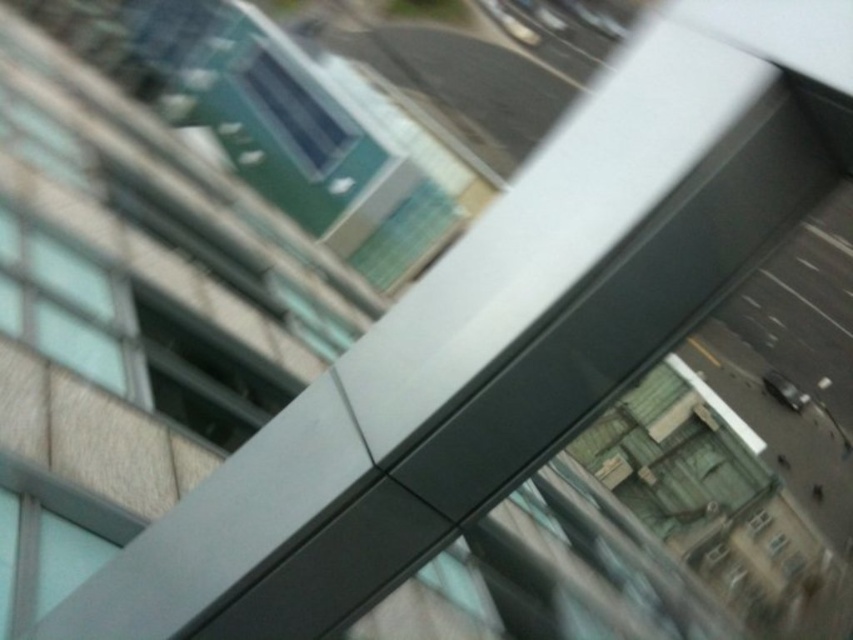
You are standing in a room and want to open the matte glass window at center. The window is 41.76 feet away from you. Can you reach it without moving closer?

The matte glass window at center is 41.76 feet away from the viewer, which is too far to reach without moving closer.

You are an interior designer assessing the window layout. You need to determine which of the two matte glass windows, the matte glass window at center or the matte glass window at upper center, is shorter in height. Which one is shorter?

The matte glass window at center is shorter in height compared to the matte glass window at upper center according to the description.

You are standing in a room with a window. You want to place a small plant exactly at the center of the matte glass window at center. According to the coordinates given, where should you place the plant?

The plant should be placed at the coordinates point (202, 374), which is the 2D location of the matte glass window at center.